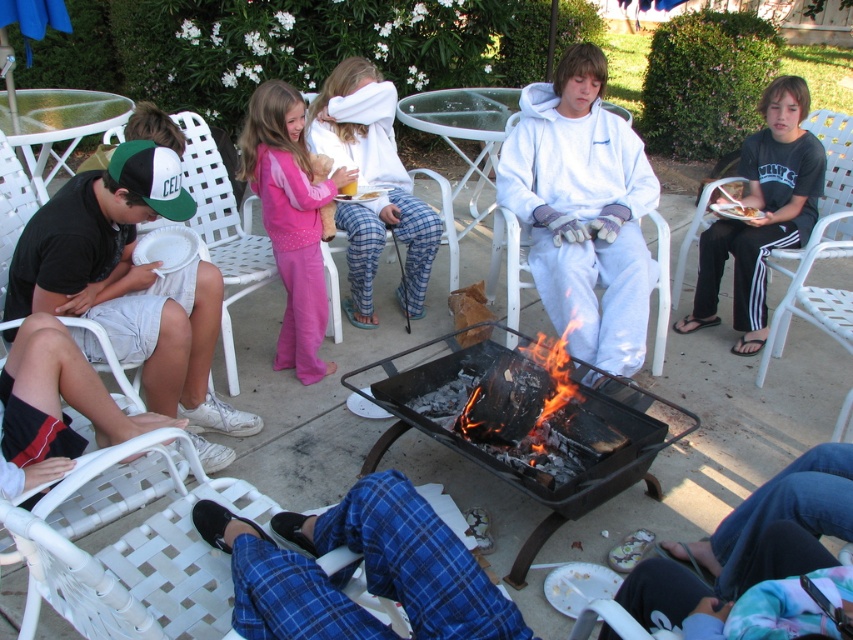
Question: Estimate the real-world distances between objects in this image. Which object is closer to the pink fleece pajamas at center?

Choices:
 (A) charcoal black grill at center
 (B) white woven plastic chair at left
 (C) charcoal fire at center
 (D) black cotton shirt at right

Answer: (B)

Question: Based on their relative distances, which object is farther from the white woven plastic chair at left?

Choices:
 (A) charcoal black grill at center
 (B) pink fleece pajamas at center
 (C) white woven plastic chair at center
 (D) black cotton shirt at right

Answer: (D)

Question: Which is farther from the white fleece hoodie at center?

Choices:
 (A) blue flannel pants at lower center
 (B) charcoal black grill at center
 (C) pink fleece pajamas at center

Answer: (A)

Question: Does black cotton shorts at left have a smaller size compared to charcoal black grill at center?

Choices:
 (A) yes
 (B) no

Answer: (A)

Question: Does blue flannel pants at lower center appear on the left side of charcoal black grill at center?

Choices:
 (A) no
 (B) yes

Answer: (B)

Question: In this image, where is blue flannel pants at lower center located relative to pink fleece pajamas at center?

Choices:
 (A) left
 (B) right

Answer: (B)